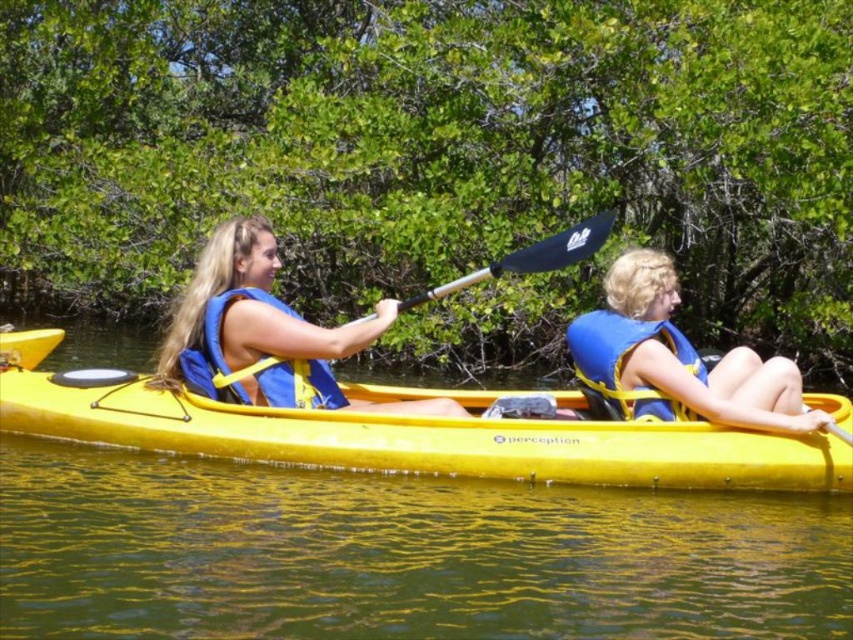
Question: Is yellow plastic canoe at center to the left of blue life vest at center from the viewer's perspective?

Choices:
 (A) no
 (B) yes

Answer: (A)

Question: Which point is closer to the camera?

Choices:
 (A) blue life vest at center
 (B) blue fabric life jacket at left
 (C) black plastic paddle at center
 (D) blue life vest at right

Answer: (B)

Question: Among these objects, which one is nearest to the camera?

Choices:
 (A) yellow plastic canoe at center
 (B) blue life vest at right
 (C) blue life vest at center

Answer: (A)

Question: Can you confirm if blue life vest at center is thinner than black plastic paddle at center?

Choices:
 (A) no
 (B) yes

Answer: (B)

Question: Is blue life vest at right in front of black plastic paddle at center?

Choices:
 (A) yes
 (B) no

Answer: (B)

Question: Which of these objects is positioned closest to the blue life vest at center?

Choices:
 (A) blue fabric life jacket at left
 (B) yellow plastic canoe at center
 (C) blue life vest at right

Answer: (A)